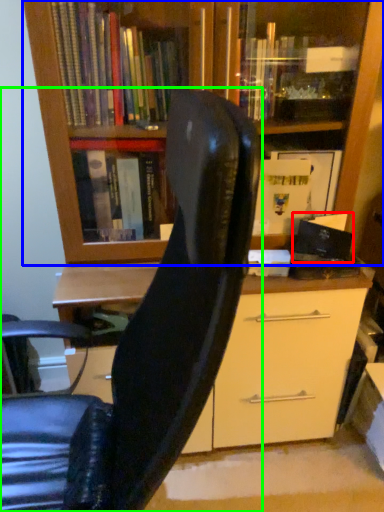
Question: Considering the real-world distances, which object is closest to paperback book (highlighted by a red box)? bookcase (highlighted by a blue box) or chair (highlighted by a green box).

Choices:
 (A) bookcase
 (B) chair

Answer: (A)